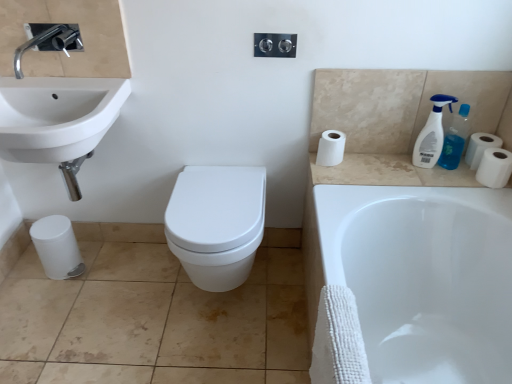
The image size is (512, 384). Identify the location of vacant area in front of white matte toilet paper at lower left, which is the fourth toilet paper in top-to-bottom order. (51, 297).